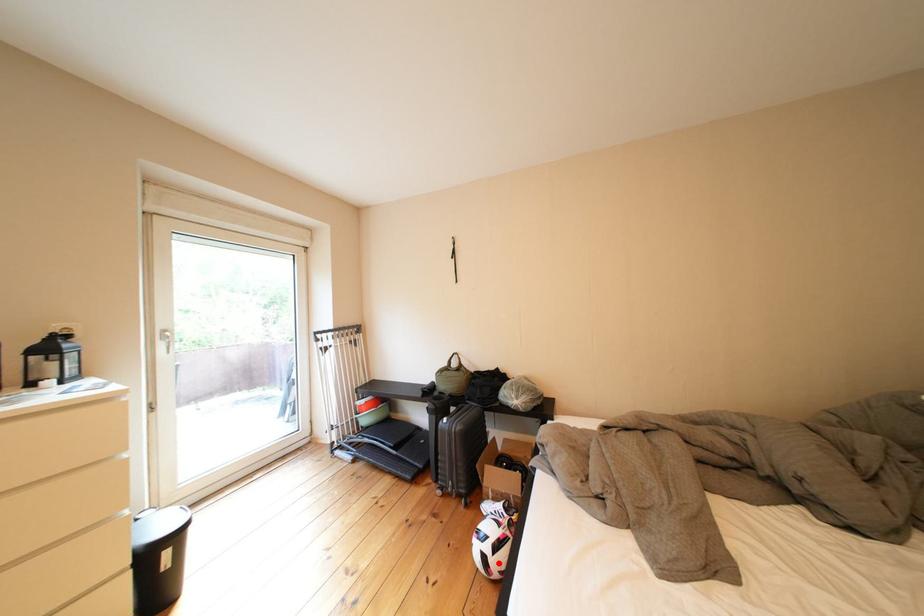
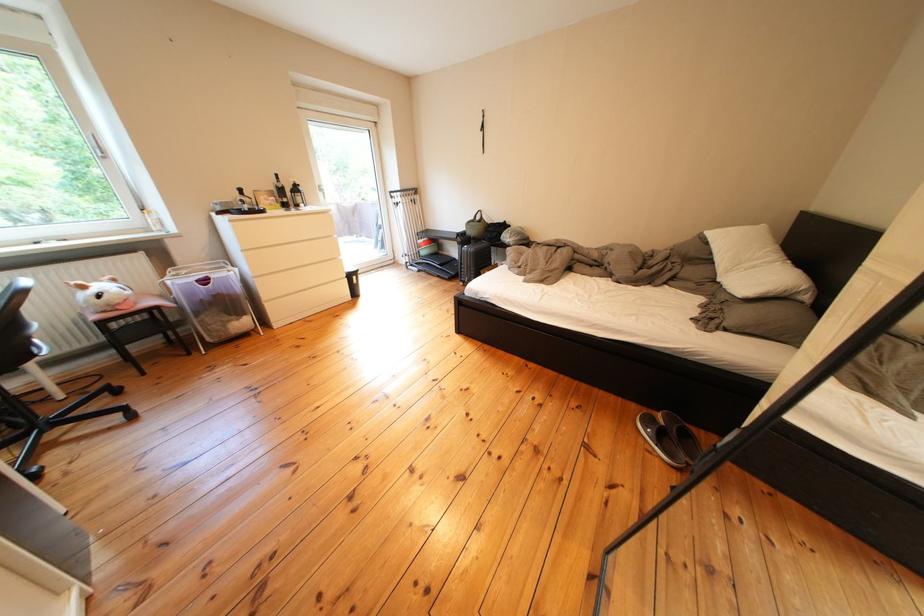
Question: I am providing you with two images of the same scene from different viewpoints. A red point is marked on the first image. Is the red point's position out of view in image 2?

Choices:
 (A) Yes
 (B) No

Answer: (A)